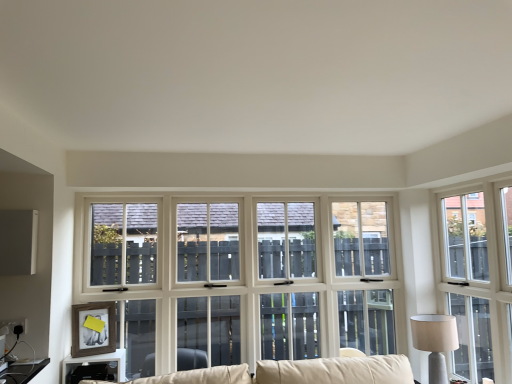
Question: Is beige fabric lampshade at right aimed at matte black table at lower left?

Choices:
 (A) yes
 (B) no

Answer: (B)

Question: Are beige fabric lampshade at right and matte black table at lower left located far from each other?

Choices:
 (A) no
 (B) yes

Answer: (B)

Question: Is beige fabric lampshade at right behind matte black table at lower left?

Choices:
 (A) yes
 (B) no

Answer: (A)

Question: Can you confirm if beige fabric lampshade at right is taller than matte black table at lower left?

Choices:
 (A) no
 (B) yes

Answer: (B)

Question: Could matte black table at lower left be considered to be inside beige fabric lampshade at right?

Choices:
 (A) no
 (B) yes

Answer: (A)

Question: Considering the relative positions of beige fabric lampshade at right and matte black table at lower left in the image provided, is beige fabric lampshade at right in front of matte black table at lower left?

Choices:
 (A) no
 (B) yes

Answer: (A)

Question: From a real-world perspective, is beige fabric lampshade at right located beneath white wood window at right?

Choices:
 (A) no
 (B) yes

Answer: (B)

Question: Is beige fabric lampshade at right outside of white wood window at right?

Choices:
 (A) no
 (B) yes

Answer: (B)

Question: Can you confirm if beige fabric lampshade at right is thinner than white wood window at right?

Choices:
 (A) yes
 (B) no

Answer: (B)

Question: Is beige fabric lampshade at right shorter than white wood window at right?

Choices:
 (A) yes
 (B) no

Answer: (A)

Question: Is beige fabric lampshade at right wider than white wood window at right?

Choices:
 (A) yes
 (B) no

Answer: (A)

Question: Considering the relative positions of beige fabric lampshade at right and white wood window at right in the image provided, is beige fabric lampshade at right to the left of white wood window at right from the viewer's perspective?

Choices:
 (A) yes
 (B) no

Answer: (A)

Question: From a real-world perspective, is matte black table at lower left located beneath white wood window at right?

Choices:
 (A) yes
 (B) no

Answer: (A)